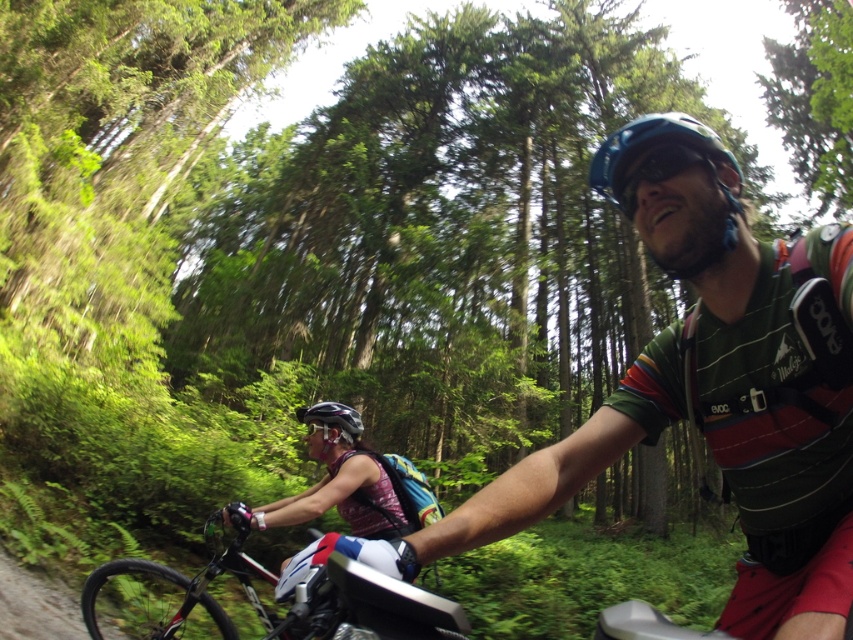
Question: Can you confirm if shiny metallic bike at center is positioned to the left of matte black helmet at lower center?

Choices:
 (A) yes
 (B) no

Answer: (A)

Question: Is shiny metallic bike at center positioned at the back of blue matte helmet at upper center?

Choices:
 (A) yes
 (B) no

Answer: (A)

Question: Which point appears closest to the camera in this image?

Choices:
 (A) (605, 141)
 (B) (138, 589)
 (C) (315, 404)

Answer: (A)

Question: Does shiny metallic bike at center appear over matte black helmet at lower center?

Choices:
 (A) no
 (B) yes

Answer: (A)

Question: Which object appears farthest from the camera in this image?

Choices:
 (A) shiny metallic bike at center
 (B) matte black helmet at lower center

Answer: (A)

Question: Which point is closer to the camera taking this photo?

Choices:
 (A) (672, 170)
 (B) (186, 580)
 (C) (344, 404)

Answer: (A)